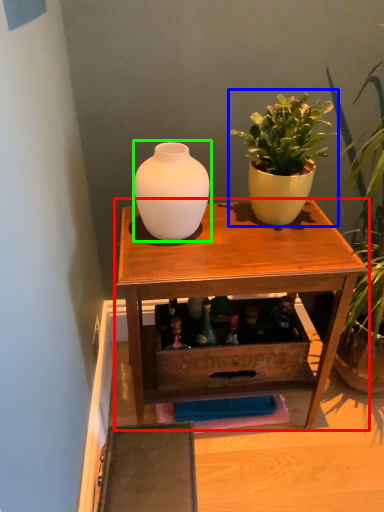
Question: Which is nearer to the table (highlighted by a red box)? houseplant (highlighted by a blue box) or vase (highlighted by a green box).

Choices:
 (A) houseplant
 (B) vase

Answer: (B)